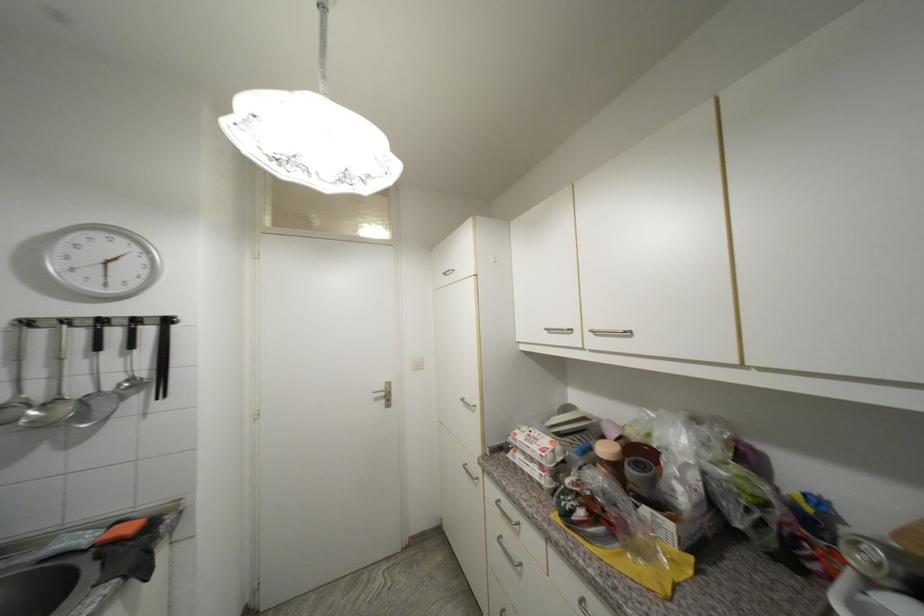
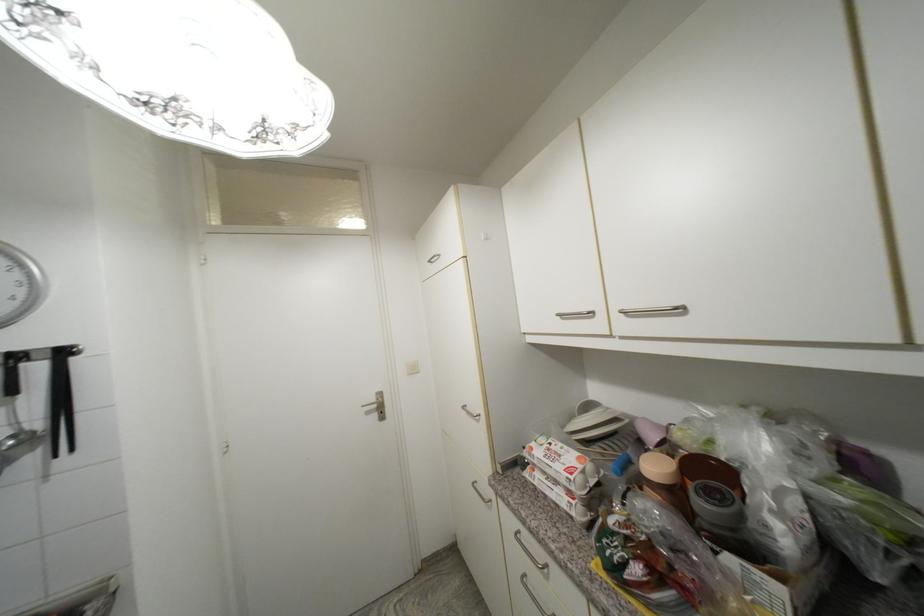
Question: I am providing you with two images of the same scene from different viewpoints. Please identify which objects are invisible in image2.

Choices:
 (A) metal door handle
 (B) plastic grocery bag
 (C) black kitchen tongs
 (D) none of these

Answer: (D)